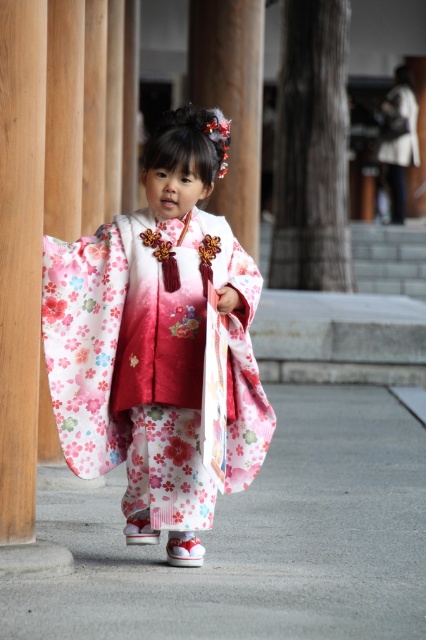
Question: Can you confirm if white concrete pavement at center is bigger than floral silk kimono at center?

Choices:
 (A) yes
 (B) no

Answer: (B)

Question: Which of the following is the closest to the observer?

Choices:
 (A) white concrete pavement at center
 (B) floral silk kimono at center

Answer: (A)

Question: Which point is farther to the camera?

Choices:
 (A) (43, 531)
 (B) (259, 416)

Answer: (A)

Question: Is white concrete pavement at center bigger than floral silk kimono at center?

Choices:
 (A) no
 (B) yes

Answer: (A)

Question: Does white concrete pavement at center appear over floral silk kimono at center?

Choices:
 (A) yes
 (B) no

Answer: (B)